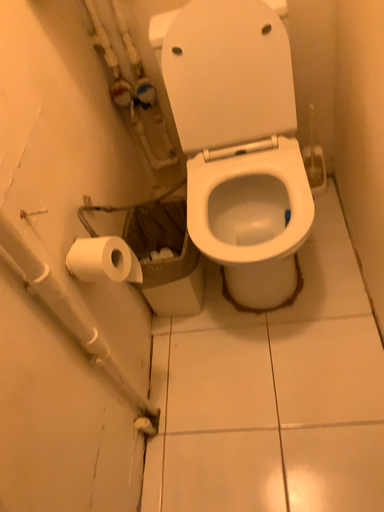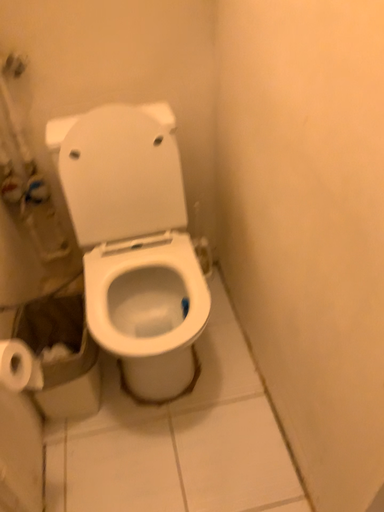
Question: Which way did the camera rotate in the video?

Choices:
 (A) rotated left
 (B) rotated right

Answer: (B)